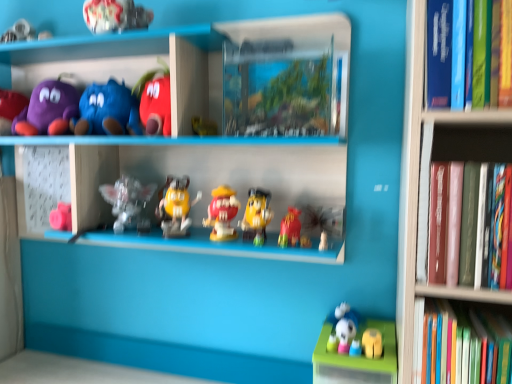
Find the location of `free point above green plastic toy at lower right (from a real-world perspective)`. free point above green plastic toy at lower right (from a real-world perspective) is located at coordinates (365, 345).